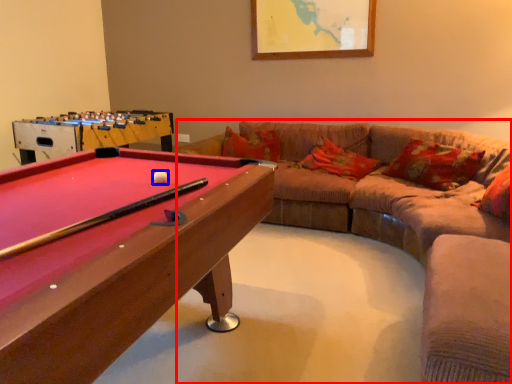
Question: Which of the following is the closest to the observer, studio couch (highlighted by a red box) or ball (highlighted by a blue box)?

Choices:
 (A) studio couch
 (B) ball

Answer: (B)